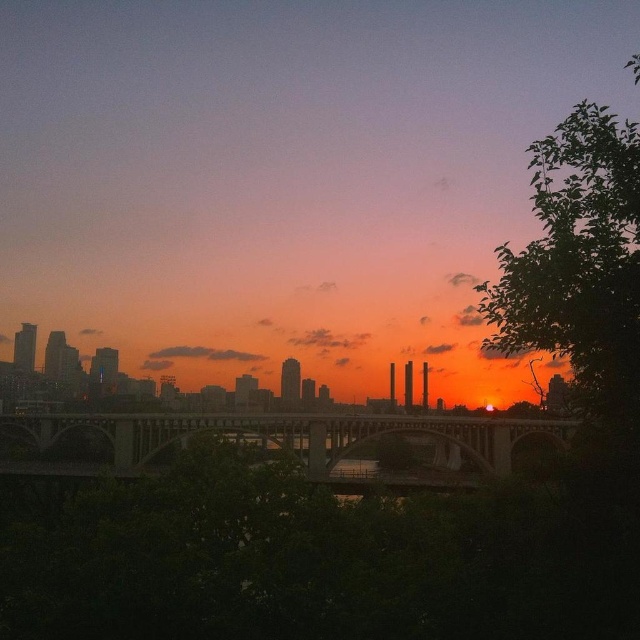
You are standing at the center of the bridge and looking towards the city skyline. Which direction should you turn to see the green leafy tree at right?

Since the green leafy tree at right is located at point coordinates of 0.411 on the x axis and 0.905 on the y axis, you should turn to your right to see the green leafy tree at right.

You are standing on the bridge in the foreground of the sunset scene. You see a point marked at coordinates (579,262). What object is located at that point?

The point at coordinates (579,262) marks a green leafy tree at the right.